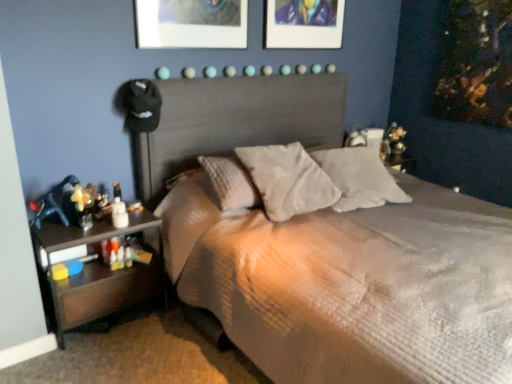
Question: Is textured gray bed at center to the left of textured gray pillow at center, positioned as the second pillow in right-to-left order, from the viewer's perspective?

Choices:
 (A) yes
 (B) no

Answer: (B)

Question: Is textured gray bed at center shorter than textured gray pillow at center, positioned as the second pillow in right-to-left order?

Choices:
 (A) no
 (B) yes

Answer: (A)

Question: Is textured gray bed at center far away from textured gray pillow at center, positioned as the second pillow in right-to-left order?

Choices:
 (A) yes
 (B) no

Answer: (B)

Question: Is textured gray bed at center facing away from textured gray pillow at center, the first pillow when ordered from left to right?

Choices:
 (A) yes
 (B) no

Answer: (A)

Question: From a real-world perspective, is textured gray bed at center positioned under textured gray pillow at center, the first pillow when ordered from left to right, based on gravity?

Choices:
 (A) no
 (B) yes

Answer: (B)

Question: Would you say textured gray bed at center contains textured gray pillow at center, the first pillow when ordered from left to right?

Choices:
 (A) no
 (B) yes

Answer: (B)

Question: Considering the relative positions of metallic silver picture frame at upper center and white soft pillow at center, which is the 1th pillow in right-to-left order, in the image provided, is metallic silver picture frame at upper center in front of white soft pillow at center, which is the 1th pillow in right-to-left order,?

Choices:
 (A) yes
 (B) no

Answer: (B)

Question: Does metallic silver picture frame at upper center come behind white soft pillow at center, which is the 1th pillow in right-to-left order?

Choices:
 (A) no
 (B) yes

Answer: (B)

Question: Does metallic silver picture frame at upper center have a lesser width compared to white soft pillow at center, which is the 1th pillow in right-to-left order?

Choices:
 (A) yes
 (B) no

Answer: (A)

Question: Can you confirm if metallic silver picture frame at upper center is wider than white soft pillow at center, the second pillow viewed from the left?

Choices:
 (A) no
 (B) yes

Answer: (A)

Question: Is metallic silver picture frame at upper center positioned beyond the bounds of white soft pillow at center, the second pillow viewed from the left?

Choices:
 (A) yes
 (B) no

Answer: (A)

Question: From the image's perspective, is metallic silver picture frame at upper center located above white soft pillow at center, which is the 1th pillow in right-to-left order?

Choices:
 (A) no
 (B) yes

Answer: (B)

Question: Considering the relative sizes of black wood nightstand at lower left and textured gray bed at center in the image provided, is black wood nightstand at lower left smaller than textured gray bed at center?

Choices:
 (A) yes
 (B) no

Answer: (A)